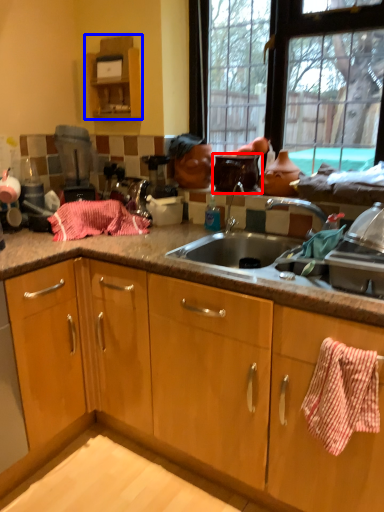
Question: Which object is further to the camera taking this photo, appliance (highlighted by a red box) or cabinetry (highlighted by a blue box)?

Choices:
 (A) appliance
 (B) cabinetry

Answer: (B)